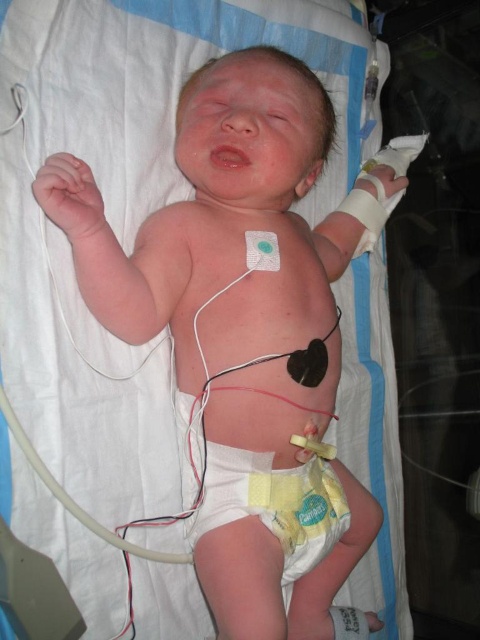
Question: Which of the following is the farthest from the observer?

Choices:
 (A) (75, 163)
 (B) (235, 474)

Answer: (B)

Question: Considering the relative positions of yellow cloth diaper at center and rubber teething ring at upper left in the image provided, where is yellow cloth diaper at center located with respect to rubber teething ring at upper left?

Choices:
 (A) above
 (B) below

Answer: (B)

Question: Among these objects, which one is nearest to the camera?

Choices:
 (A) yellow cloth diaper at center
 (B) rubber teething ring at upper left

Answer: (B)

Question: Which point is farther from the camera taking this photo?

Choices:
 (A) (291, 548)
 (B) (76, 168)

Answer: (A)

Question: Does yellow cloth diaper at center appear over rubber teething ring at upper left?

Choices:
 (A) yes
 (B) no

Answer: (B)

Question: From the image, what is the correct spatial relationship of yellow cloth diaper at center in relation to rubber teething ring at upper left?

Choices:
 (A) below
 (B) above

Answer: (A)